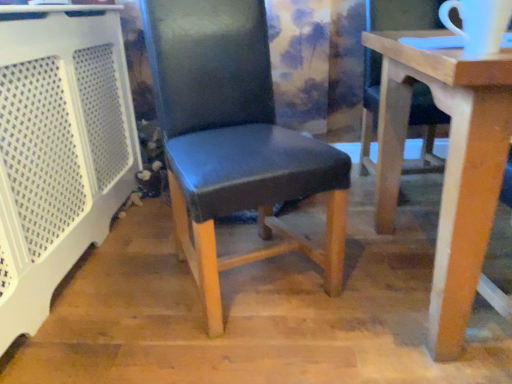
Question: In which direction should I rotate to look at black leather chair at center, placed as the second chair when sorted from right to left?

Choices:
 (A) left
 (B) right

Answer: (A)

Question: From the image's perspective, is white perforated plastic at left beneath matte black chair at center, the second chair when ordered from left to right?

Choices:
 (A) yes
 (B) no

Answer: (B)

Question: Can you confirm if white perforated plastic at left is taller than matte black chair at center, the second chair when ordered from left to right?

Choices:
 (A) no
 (B) yes

Answer: (B)

Question: Does white perforated plastic at left come in front of matte black chair at center, acting as the first chair starting from the right?

Choices:
 (A) no
 (B) yes

Answer: (A)

Question: Considering the relative sizes of white perforated plastic at left and matte black chair at center, acting as the first chair starting from the right, in the image provided, is white perforated plastic at left thinner than matte black chair at center, acting as the first chair starting from the right,?

Choices:
 (A) no
 (B) yes

Answer: (B)

Question: Is white perforated plastic at left smaller than matte black chair at center, the second chair when ordered from left to right?

Choices:
 (A) yes
 (B) no

Answer: (A)

Question: From a real-world perspective, is white perforated plastic at left located beneath matte black chair at center, the second chair when ordered from left to right?

Choices:
 (A) no
 (B) yes

Answer: (A)

Question: Does matte black chair at center, acting as the first chair starting from the right, come in front of black leather chair at center, marked as the first chair in a left-to-right arrangement?

Choices:
 (A) no
 (B) yes

Answer: (B)

Question: Is matte black chair at center, acting as the first chair starting from the right, positioned with its back to black leather chair at center, marked as the first chair in a left-to-right arrangement?

Choices:
 (A) no
 (B) yes

Answer: (A)

Question: From a real-world perspective, is matte black chair at center, the second chair when ordered from left to right, over black leather chair at center, marked as the first chair in a left-to-right arrangement?

Choices:
 (A) no
 (B) yes

Answer: (A)

Question: Can you confirm if matte black chair at center, the second chair when ordered from left to right, is smaller than black leather chair at center, marked as the first chair in a left-to-right arrangement?

Choices:
 (A) no
 (B) yes

Answer: (A)

Question: Can you confirm if matte black chair at center, acting as the first chair starting from the right, is thinner than black leather chair at center, marked as the first chair in a left-to-right arrangement?

Choices:
 (A) yes
 (B) no

Answer: (B)

Question: Is matte black chair at center, acting as the first chair starting from the right, far from black leather chair at center, marked as the first chair in a left-to-right arrangement?

Choices:
 (A) yes
 (B) no

Answer: (B)

Question: Could matte black chair at center, acting as the first chair starting from the right, be considered to be inside black leather chair at center, marked as the first chair in a left-to-right arrangement?

Choices:
 (A) yes
 (B) no

Answer: (B)